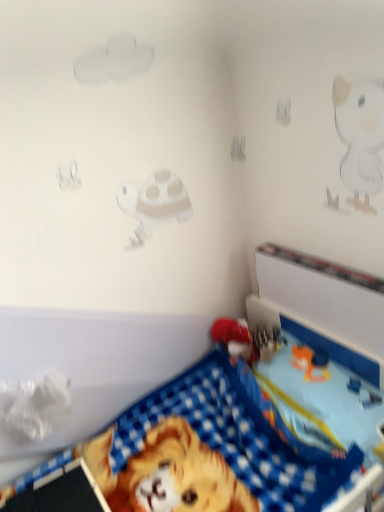
What is the approximate width of matte red toy at center, the first toy positioned from the right?

It is 4.99 inches.

What do you see at coordinates (235, 338) in the screenshot?
I see `matte red toy at center, the first toy positioned from the right` at bounding box center [235, 338].

Locate an element on the screen. This screenshot has width=384, height=512. matte red toy at center, the 2th toy in the left-to-right sequence is located at coordinates (235, 338).

In order to face matte red toy at center, the 2th toy in the left-to-right sequence, should I rotate leftwards or rightwards?

It's best to rotate right around 4.744 degrees.

What is the approximate width of blue fabric blanket at lower right, which is counted as the first toy, starting from the left?

It is 32.67 inches.

Consider the image. Measure the distance between blue fabric blanket at lower right, which is counted as the first toy, starting from the left, and camera.

The distance of blue fabric blanket at lower right, which is counted as the first toy, starting from the left, from camera is 1.05 meters.

Measure the distance between point (266, 428) and camera.

Point (266, 428) is 4.37 feet away from camera.

Find the location of `blue fabric blanket at lower right, which is counted as the first toy, starting from the left`. blue fabric blanket at lower right, which is counted as the first toy, starting from the left is located at coordinates (271, 400).

Image resolution: width=384 pixels, height=512 pixels. Describe the element at coordinates (271, 400) in the screenshot. I see `blue fabric blanket at lower right, which is the 2th toy in right-to-left order` at that location.

The width and height of the screenshot is (384, 512). Find the location of `matte red toy at center, the 2th toy in the left-to-right sequence`. matte red toy at center, the 2th toy in the left-to-right sequence is located at coordinates (235, 338).

Considering the positions of objects matte red toy at center, the 2th toy in the left-to-right sequence, and blue fabric blanket at lower right, which is counted as the first toy, starting from the left, in the image provided, who is more to the right, matte red toy at center, the 2th toy in the left-to-right sequence, or blue fabric blanket at lower right, which is counted as the first toy, starting from the left,?

Positioned to the right is matte red toy at center, the 2th toy in the left-to-right sequence.

Which object is further away from the camera, matte red toy at center, the first toy positioned from the right, or blue fabric blanket at lower right, which is counted as the first toy, starting from the left?

matte red toy at center, the first toy positioned from the right, is further from the camera.

Considering the points (236, 344) and (338, 367), which point is in front, point (236, 344) or point (338, 367)?

Positioned in front is point (338, 367).

From the image's perspective, relative to blue fabric blanket at lower right, which is counted as the first toy, starting from the left, is matte red toy at center, the 2th toy in the left-to-right sequence, above or below?

Based on their image positions, matte red toy at center, the 2th toy in the left-to-right sequence, is located above blue fabric blanket at lower right, which is counted as the first toy, starting from the left.

From a real-world perspective, relative to blue fabric blanket at lower right, which is the 2th toy in right-to-left order, is matte red toy at center, the first toy positioned from the right, vertically above or below?

matte red toy at center, the first toy positioned from the right, is situated higher than blue fabric blanket at lower right, which is the 2th toy in right-to-left order, in the real world.

Looking at their sizes, would you say matte red toy at center, the 2th toy in the left-to-right sequence, is wider or thinner than blue fabric blanket at lower right, which is the 2th toy in right-to-left order?

In the image, matte red toy at center, the 2th toy in the left-to-right sequence, appears to be more narrow than blue fabric blanket at lower right, which is the 2th toy in right-to-left order.

Considering the relative sizes of matte red toy at center, the 2th toy in the left-to-right sequence, and blue fabric blanket at lower right, which is counted as the first toy, starting from the left, in the image provided, is matte red toy at center, the 2th toy in the left-to-right sequence, taller than blue fabric blanket at lower right, which is counted as the first toy, starting from the left,?

No, matte red toy at center, the 2th toy in the left-to-right sequence, is not taller than blue fabric blanket at lower right, which is counted as the first toy, starting from the left.

Does matte red toy at center, the 2th toy in the left-to-right sequence, have a larger size compared to blue fabric blanket at lower right, which is counted as the first toy, starting from the left?

No.

Does matte red toy at center, the 2th toy in the left-to-right sequence, contain blue fabric blanket at lower right, which is the 2th toy in right-to-left order?

Actually, blue fabric blanket at lower right, which is the 2th toy in right-to-left order, is outside matte red toy at center, the 2th toy in the left-to-right sequence.

Based on the photo, is matte red toy at center, the 2th toy in the left-to-right sequence, positioned far away from blue fabric blanket at lower right, which is the 2th toy in right-to-left order?

No, there isn't a large distance between matte red toy at center, the 2th toy in the left-to-right sequence, and blue fabric blanket at lower right, which is the 2th toy in right-to-left order.

Could you tell me if matte red toy at center, the 2th toy in the left-to-right sequence, is turned towards blue fabric blanket at lower right, which is the 2th toy in right-to-left order?

Yes, matte red toy at center, the 2th toy in the left-to-right sequence, is aimed at blue fabric blanket at lower right, which is the 2th toy in right-to-left order.

How much distance is there between matte red toy at center, the first toy positioned from the right, and blue fabric blanket at lower right, which is the 2th toy in right-to-left order?

They are 11.23 inches apart.

In the image, there is a matte red toy at center, the first toy positioned from the right. Where is `toy below it (from a real-world perspective)`? toy below it (from a real-world perspective) is located at coordinates (271, 400).

Consider the image. Which is more to the left, blue fabric blanket at lower right, which is counted as the first toy, starting from the left, or matte red toy at center, the first toy positioned from the right?

blue fabric blanket at lower right, which is counted as the first toy, starting from the left.

Is blue fabric blanket at lower right, which is counted as the first toy, starting from the left, in front of or behind matte red toy at center, the first toy positioned from the right, in the image?

blue fabric blanket at lower right, which is counted as the first toy, starting from the left, is in front of matte red toy at center, the first toy positioned from the right.

Which is closer, [290,358] or [221,324]?

Point [290,358]

From the image's perspective, would you say blue fabric blanket at lower right, which is counted as the first toy, starting from the left, is positioned over matte red toy at center, the first toy positioned from the right?

No.

From a real-world perspective, who is located lower, blue fabric blanket at lower right, which is counted as the first toy, starting from the left, or matte red toy at center, the 2th toy in the left-to-right sequence?

In real-world perspective, blue fabric blanket at lower right, which is counted as the first toy, starting from the left, is lower.

Which of these two, blue fabric blanket at lower right, which is counted as the first toy, starting from the left, or matte red toy at center, the first toy positioned from the right, is wider?

Wider between the two is blue fabric blanket at lower right, which is counted as the first toy, starting from the left.

Which of these two, blue fabric blanket at lower right, which is the 2th toy in right-to-left order, or matte red toy at center, the 2th toy in the left-to-right sequence, stands taller?

Standing taller between the two is blue fabric blanket at lower right, which is the 2th toy in right-to-left order.

Based on their sizes in the image, would you say blue fabric blanket at lower right, which is the 2th toy in right-to-left order, is bigger or smaller than matte red toy at center, the first toy positioned from the right?

In the image, blue fabric blanket at lower right, which is the 2th toy in right-to-left order, appears to be larger than matte red toy at center, the first toy positioned from the right.

Is blue fabric blanket at lower right, which is the 2th toy in right-to-left order, situated inside matte red toy at center, the 2th toy in the left-to-right sequence, or outside?

blue fabric blanket at lower right, which is the 2th toy in right-to-left order, is not inside matte red toy at center, the 2th toy in the left-to-right sequence, it's outside.

Are blue fabric blanket at lower right, which is counted as the first toy, starting from the left, and matte red toy at center, the 2th toy in the left-to-right sequence, located far from each other?

No, blue fabric blanket at lower right, which is counted as the first toy, starting from the left, is in close proximity to matte red toy at center, the 2th toy in the left-to-right sequence.

Is blue fabric blanket at lower right, which is counted as the first toy, starting from the left, oriented away from matte red toy at center, the first toy positioned from the right?

Yes, blue fabric blanket at lower right, which is counted as the first toy, starting from the left, is positioned with its back facing matte red toy at center, the first toy positioned from the right.

How different are the orientations of blue fabric blanket at lower right, which is counted as the first toy, starting from the left, and matte red toy at center, the first toy positioned from the right, in degrees?

The angular difference between blue fabric blanket at lower right, which is counted as the first toy, starting from the left, and matte red toy at center, the first toy positioned from the right, is 86.4 degrees.

You are a GUI agent. You are given a task and a screenshot of the screen. Output one action in this format:
    pyautogui.click(x=<x>, y=<y>)
    Task: Click on the toy lying below the matte red toy at center, the 2th toy in the left-to-right sequence (from the image's perspective)
    
    Given the screenshot: What is the action you would take?
    pyautogui.click(x=271, y=400)

The width and height of the screenshot is (384, 512). What are the coordinates of `toy above the blue fabric blanket at lower right, which is counted as the first toy, starting from the left (from a real-world perspective)` in the screenshot? It's located at (235, 338).

Image resolution: width=384 pixels, height=512 pixels. In order to click on toy that is on the left side of matte red toy at center, the 2th toy in the left-to-right sequence in this screenshot , I will do `click(271, 400)`.